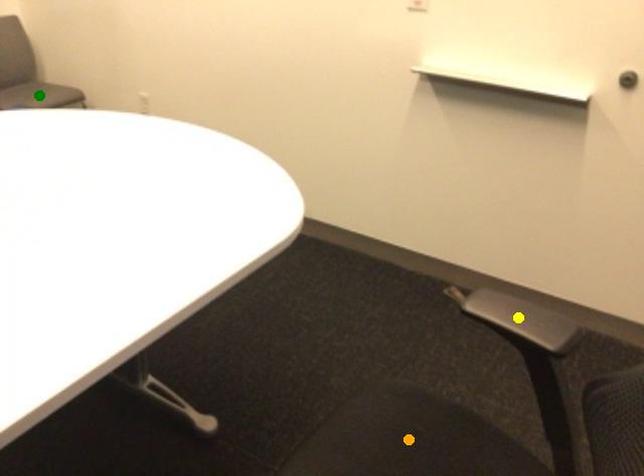
Order these from farthest to nearest:
yellow point
green point
orange point

green point < yellow point < orange point